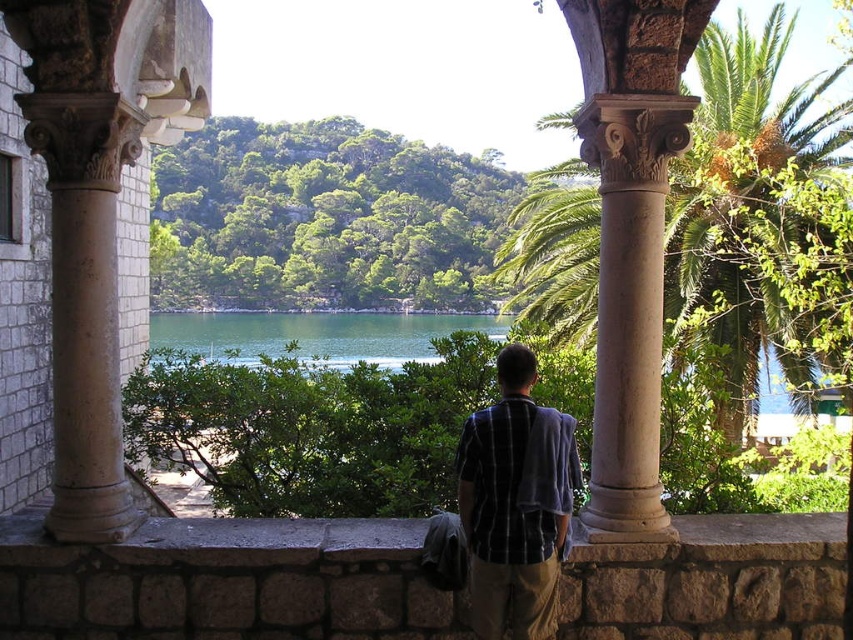
You are standing on the stone balcony and want to take a photo of the two points mentioned. Which point, point (572, 589) or point (619, 493), will appear larger in your camera view?

Point (572, 589) will appear larger in the camera view because it is closer to the camera than point (619, 493).

You are standing on the stone balcony and want to take a photo of the green leafy palm tree at center. If your camera has a maximum zoom range of 5 meters, will you be able to capture the tree clearly without moving closer?

The green leafy palm tree at center is 6.80 meters away from the viewer. Since the camera can only zoom up to 5 meters, you won cannot capture the tree clearly without moving closer.

You are standing on the balcony and want to place a small potted plant between the beige stone column at left and the smooth stone column at center. Which column should you place it closer to if you want the plant to be centered between them?

The beige stone column at left is wider than the smooth stone column at center. To center the plant between them, place it closer to the beige stone column at left since it occupies more space, balancing the distance from both columns.